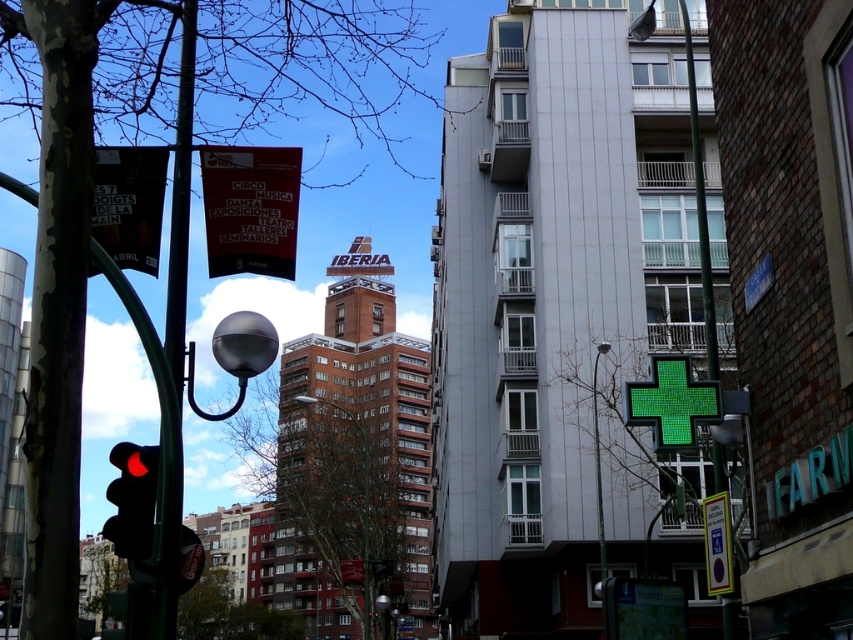
Question: Does black glass traffic light at left appear on the left side of green plastic sign at lower right?

Choices:
 (A) yes
 (B) no

Answer: (A)

Question: Does black glass traffic light at left appear on the left side of brown wooden pole at center?

Choices:
 (A) no
 (B) yes

Answer: (B)

Question: Which point is farther to the camera?

Choices:
 (A) black glass traffic light at left
 (B) brown wooden pole at center

Answer: (B)

Question: Which object is closer to the camera taking this photo?

Choices:
 (A) black glass traffic light at left
 (B) brown wooden pole at center

Answer: (A)

Question: Does green plastic sign at lower right appear on the right side of brown wooden pole at center?

Choices:
 (A) yes
 (B) no

Answer: (A)

Question: Which point is farther to the camera?

Choices:
 (A) brown wooden pole at center
 (B) green plastic sign at lower right

Answer: (A)